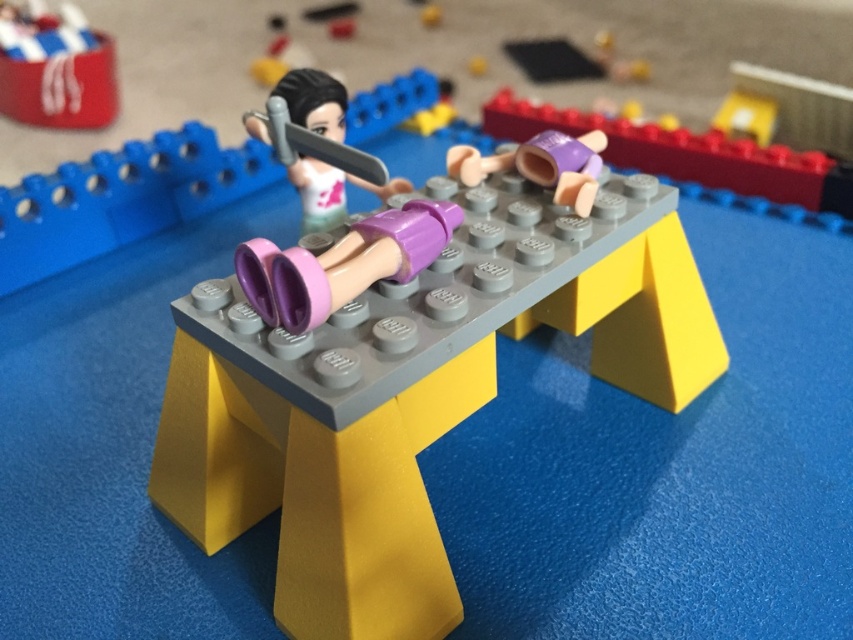
Question: Considering the real-world distances, which object is closest to the purple plastic doll at center?

Choices:
 (A) purple matte/soft plastic legs at center
 (B) purple plastic head at center
 (C) matte red can at upper left
 (D) matte plastic sword at center

Answer: (A)

Question: In this image, where is purple plastic doll at center located relative to purple plastic head at center?

Choices:
 (A) right
 (B) left

Answer: (B)

Question: Which of the following is the closest to the observer?

Choices:
 (A) purple matte/soft plastic legs at center
 (B) matte red can at upper left

Answer: (A)

Question: Considering the relative positions of purple plastic head at center and matte red can at upper left in the image provided, where is purple plastic head at center located with respect to matte red can at upper left?

Choices:
 (A) right
 (B) left

Answer: (A)

Question: In this image, where is purple plastic doll at center located relative to matte red can at upper left?

Choices:
 (A) below
 (B) above

Answer: (A)

Question: Which of the following is the closest to the observer?

Choices:
 (A) (611, 129)
 (B) (367, 182)
 (C) (47, 88)
 (D) (341, 616)

Answer: (D)